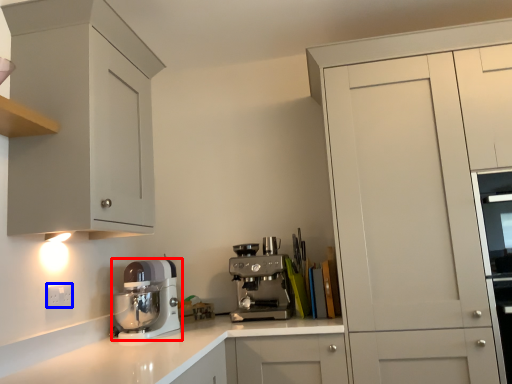
Question: Among these objects, which one is nearest to the camera, kitchen appliance (highlighted by a red box) or electric outlet (highlighted by a blue box)?

Choices:
 (A) kitchen appliance
 (B) electric outlet

Answer: (B)